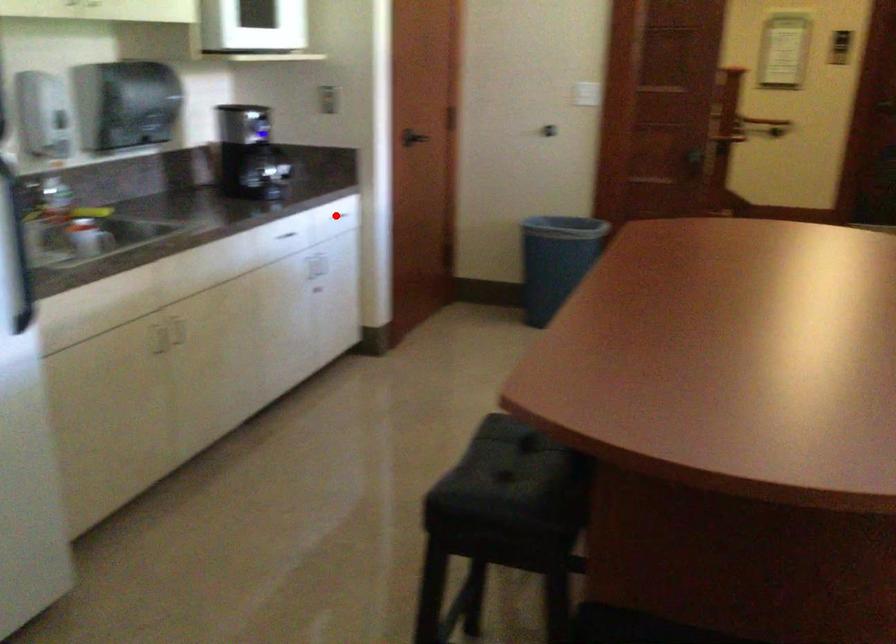
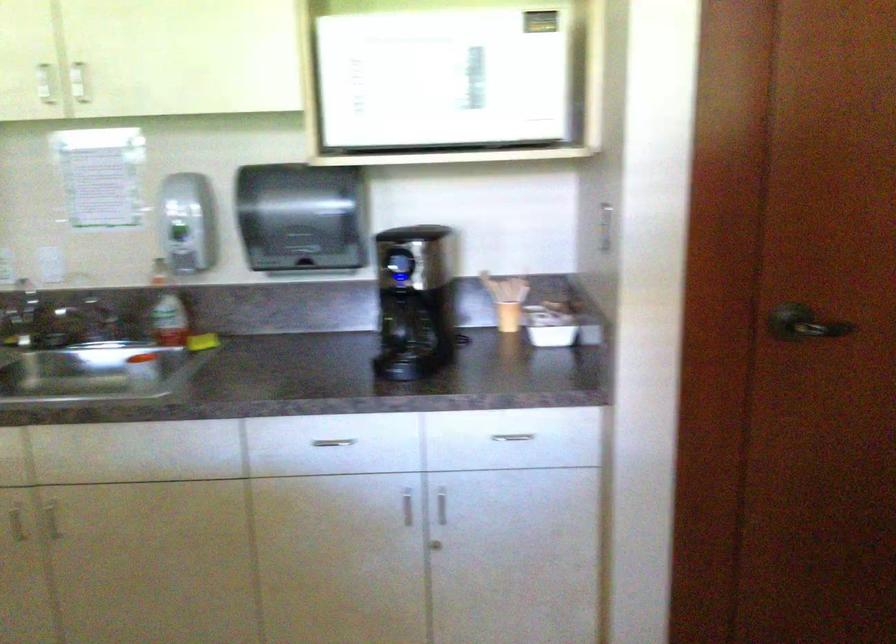
Where in the second image is the point corresponding to the highlighted location from the first image?

(512, 437)